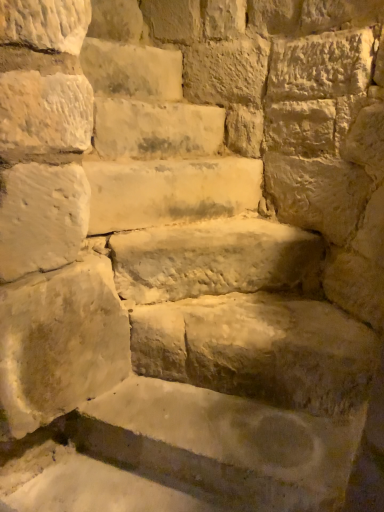
Question: Can you confirm if white stone at center, which is the second brick from bottom to top, is bigger than smooth stone brick at upper left, arranged as the first brick when viewed from the top?

Choices:
 (A) no
 (B) yes

Answer: (A)

Question: Is white stone at center, acting as the third brick starting from the top, at the left side of smooth stone brick at upper left, which ranks as the fourth brick in bottom-to-top order?

Choices:
 (A) yes
 (B) no

Answer: (B)

Question: From a real-world perspective, is white stone at center, which is the second brick from bottom to top, located beneath smooth stone brick at upper left, arranged as the first brick when viewed from the top?

Choices:
 (A) no
 (B) yes

Answer: (B)

Question: From the image's perspective, is white stone at center, which is the second brick from bottom to top, over smooth stone brick at upper left, which ranks as the fourth brick in bottom-to-top order?

Choices:
 (A) yes
 (B) no

Answer: (B)

Question: Does white stone at center, which is the second brick from bottom to top, come in front of smooth stone brick at upper left, which ranks as the fourth brick in bottom-to-top order?

Choices:
 (A) no
 (B) yes

Answer: (B)

Question: In the image, is smooth stone step at center on the left side or the right side of smooth stone bench at center, the first brick positioned from the bottom?

Choices:
 (A) right
 (B) left

Answer: (B)

Question: From a real-world perspective, is smooth stone step at center above or below smooth stone bench at center, which is counted as the fourth brick, starting from the top?

Choices:
 (A) above
 (B) below

Answer: (A)

Question: From the image's perspective, is smooth stone step at center located above or below smooth stone bench at center, which is counted as the fourth brick, starting from the top?

Choices:
 (A) below
 (B) above

Answer: (B)

Question: Is smooth stone step at center inside or outside of smooth stone bench at center, which is counted as the fourth brick, starting from the top?

Choices:
 (A) outside
 (B) inside

Answer: (A)

Question: Would you say smooth stone step at center is to the left or to the right of smooth stone brick at upper left, acting as the 3th brick starting from the bottom, in the picture?

Choices:
 (A) right
 (B) left

Answer: (A)

Question: Would you say smooth stone step at center is inside or outside smooth stone brick at upper left, which ranks as the 2th brick in top-to-bottom order?

Choices:
 (A) outside
 (B) inside

Answer: (A)

Question: From a real-world perspective, relative to smooth stone brick at upper left, acting as the 3th brick starting from the bottom, is smooth stone step at center vertically above or below?

Choices:
 (A) below
 (B) above

Answer: (A)

Question: From their relative heights in the image, would you say smooth stone step at center is taller or shorter than smooth stone brick at upper left, acting as the 3th brick starting from the bottom?

Choices:
 (A) tall
 (B) short

Answer: (B)

Question: Is smooth stone bench at center, the first brick positioned from the bottom, bigger or smaller than white stone at center, which is the second brick from bottom to top?

Choices:
 (A) small
 (B) big

Answer: (B)

Question: Is smooth stone bench at center, the first brick positioned from the bottom, inside the boundaries of white stone at center, which is the second brick from bottom to top, or outside?

Choices:
 (A) outside
 (B) inside

Answer: (A)